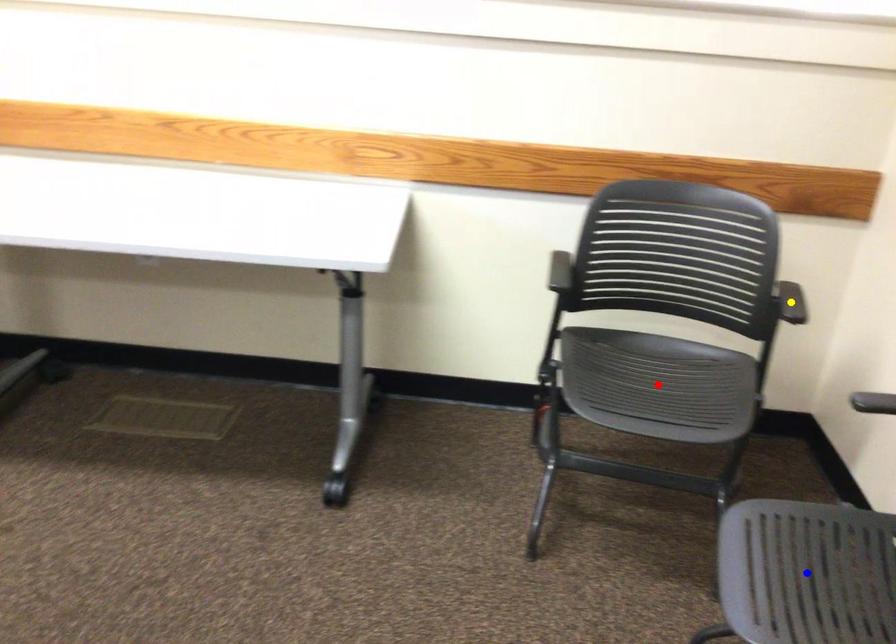
Order these from nearest to farthest:
1. yellow point
2. blue point
3. red point

blue point → yellow point → red point